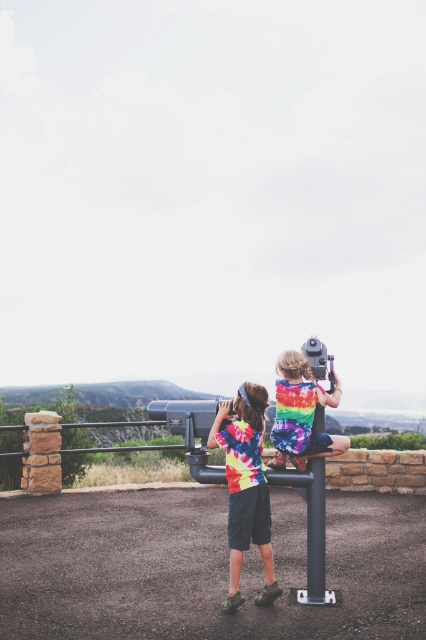
Is point (238, 484) less distant than point (293, 371)?

Yes, point (238, 484) is closer to viewer.

What do you see at coordinates (245, 486) in the screenshot? I see `tie-dye fabric shirt at center` at bounding box center [245, 486].

Which is behind, point (232, 508) or point (328, 436)?

The point (328, 436) is more distant.

The height and width of the screenshot is (640, 426). I want to click on tie-dye fabric shirt at center, so click(245, 486).